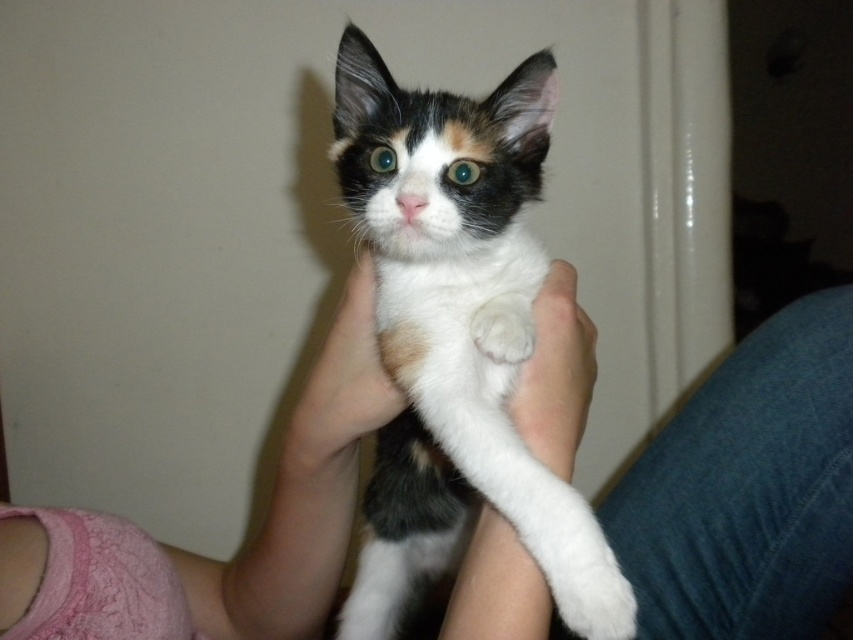
Does pink fabric at upper left come in front of white fluffy paw at center?

That is True.

What are the coordinates of `pink fabric at upper left` in the screenshot? It's located at (749, 488).

This screenshot has height=640, width=853. What are the coordinates of `pink fabric at upper left` in the screenshot? It's located at (749, 488).

Is soft skin hand at center smaller than white fluffy paw at center?

No.

Does soft skin hand at center have a lesser width compared to white fluffy paw at center?

No.

Does point (368, 371) come farther from viewer compared to point (492, 310)?

Yes, it is.

Where is `soft skin hand at center`? The image size is (853, 640). soft skin hand at center is located at coordinates 341,387.

Does pink fabric at upper left come in front of white smooth skin at center?

Yes, pink fabric at upper left is in front of white smooth skin at center.

Which is above, pink fabric at upper left or white smooth skin at center?

pink fabric at upper left is higher up.

Find the location of a particular element. This screenshot has height=640, width=853. pink fabric at upper left is located at coordinates (749, 488).

Image resolution: width=853 pixels, height=640 pixels. In order to click on pink fabric at upper left in this screenshot , I will do `click(749, 488)`.